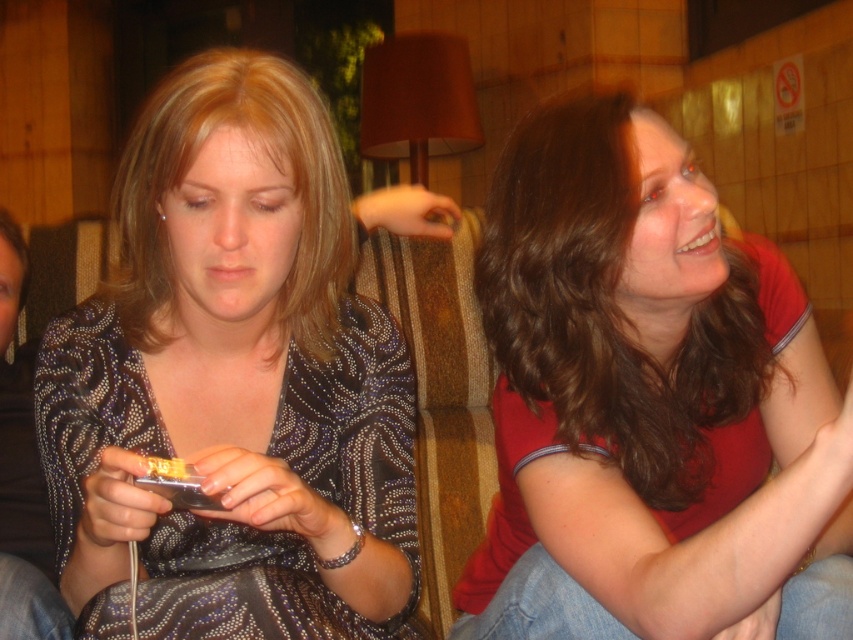
Question: Among these points, which one is nearest to the camera?

Choices:
 (A) (173, 467)
 (B) (183, 262)
 (C) (555, 301)
 (D) (328, 259)

Answer: (A)

Question: Among these objects, which one is nearest to the camera?

Choices:
 (A) matte red shirt at right
 (B) matte black dress at center
 (C) sparkly dark blue dress at center

Answer: (A)

Question: Which of the following is the farthest from the observer?

Choices:
 (A) sparkly dark blue dress at center
 (B) matte black dress at center

Answer: (B)

Question: Is the position of sparkly dark blue dress at center more distant than that of matte gold phone at lower left?

Choices:
 (A) yes
 (B) no

Answer: (B)

Question: Is matte red shirt at right below matte gold phone at lower left?

Choices:
 (A) yes
 (B) no

Answer: (B)

Question: Can you confirm if sparkly dark blue dress at center is positioned to the right of matte gold phone at lower left?

Choices:
 (A) yes
 (B) no

Answer: (A)